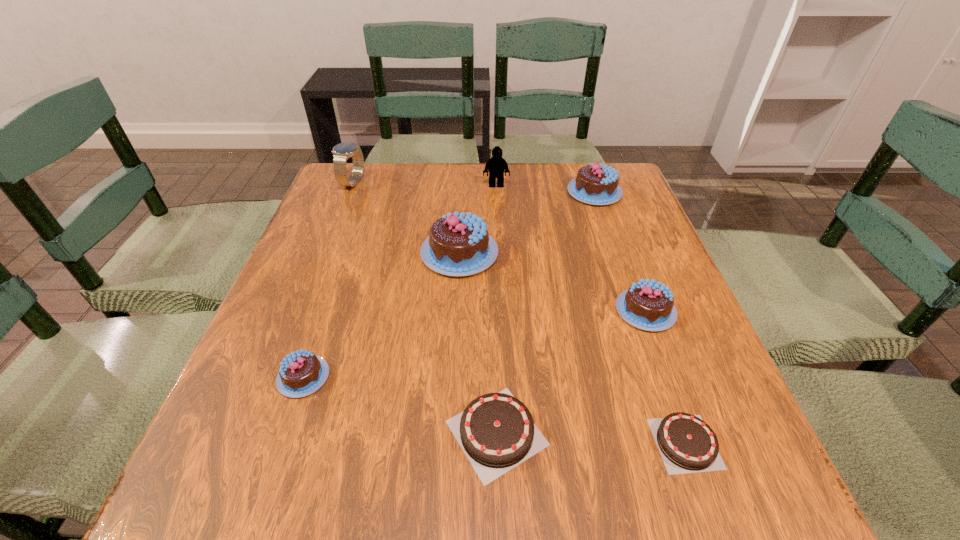
Find the location of a particular element. the left brown chocolate cake is located at coordinates (496, 431).

Locate an element on the screen. The width and height of the screenshot is (960, 540). the seventh tallest object is located at coordinates (496, 431).

Find the location of a particular element. This screenshot has height=540, width=960. the shortest object is located at coordinates (687, 444).

Locate an element on the screen. The image size is (960, 540). the smaller brown chocolate cake is located at coordinates (687, 444).

This screenshot has height=540, width=960. Find the location of `vacant space located on the face of the Lego`. vacant space located on the face of the Lego is located at coordinates pos(497,211).

You are a GUI agent. You are given a task and a screenshot of the screen. Output one action in this format:
    pyautogui.click(x=<x>, y=<y>)
    Task: Click on the vacant space situated on the right of the watch
    The image size is (960, 540).
    Given the screenshot: What is the action you would take?
    pyautogui.click(x=449, y=183)

This screenshot has width=960, height=540. I want to click on blank space located on the back of the biggest pink chocolate cake, so click(x=462, y=205).

The height and width of the screenshot is (540, 960). What are the coordinates of `vacant space located on the left of the farthest pink chocolate cake` in the screenshot? It's located at (506, 192).

Locate an element on the screen. This screenshot has height=540, width=960. vacant space located 0.280m on the back of the fifth farthest object is located at coordinates (610, 214).

What are the coordinates of `vacant position located 0.080m on the back of the leftmost chocolate cake` in the screenshot? It's located at (322, 323).